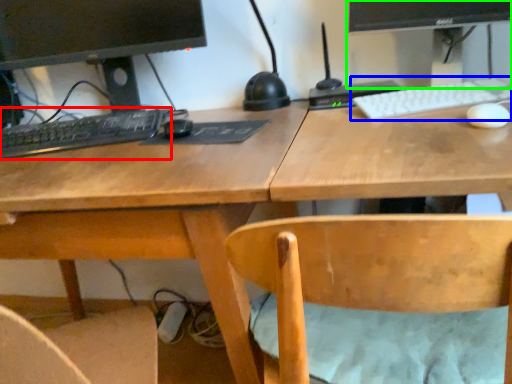
Question: Which object is positioned farthest from computer keyboard (highlighted by a red box)? Select from computer keyboard (highlighted by a blue box) and computer monitor (highlighted by a green box).

Choices:
 (A) computer keyboard
 (B) computer monitor

Answer: (B)